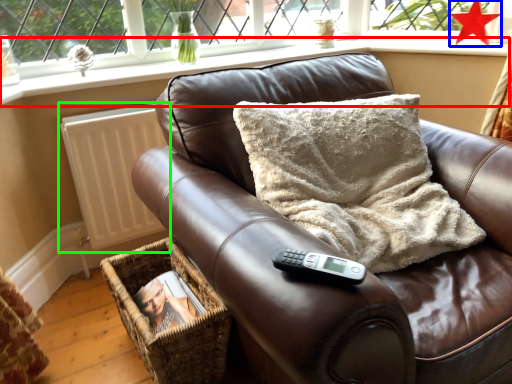
Question: Which object is the farthest from window sill (highlighted by a red box)? Choose among these: star (highlighted by a blue box) or radiator (highlighted by a green box).

Choices:
 (A) star
 (B) radiator

Answer: (A)